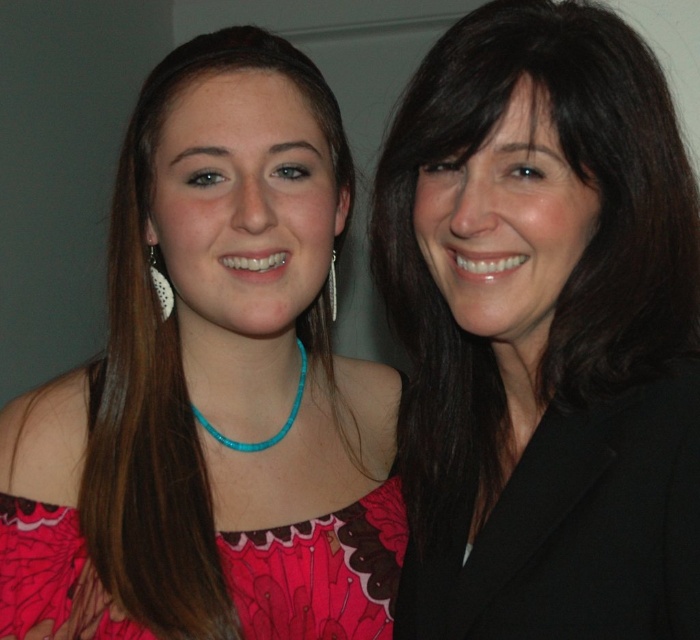
Question: Which object appears closest to the camera in this image?

Choices:
 (A) pearl-like textured earring at left
 (B) pink floral fabric dress at lower left
 (C) black glossy hair at right

Answer: (C)

Question: Is pink fabric dress at center to the right of pink floral fabric dress at lower left from the viewer's perspective?

Choices:
 (A) yes
 (B) no

Answer: (B)

Question: Which object appears farthest from the camera in this image?

Choices:
 (A) silver metallic earring at center
 (B) black glossy hair at right
 (C) pink floral fabric dress at lower left

Answer: (A)

Question: Can you confirm if black glossy hair at right is positioned to the left of pearl-like textured earring at left?

Choices:
 (A) yes
 (B) no

Answer: (B)

Question: Among these objects, which one is nearest to the camera?

Choices:
 (A) pearl-like textured earring at left
 (B) pink fabric dress at center
 (C) pink floral fabric dress at lower left

Answer: (B)

Question: Is the position of pearl-like textured earring at left more distant than that of silver metallic earring at center?

Choices:
 (A) yes
 (B) no

Answer: (B)